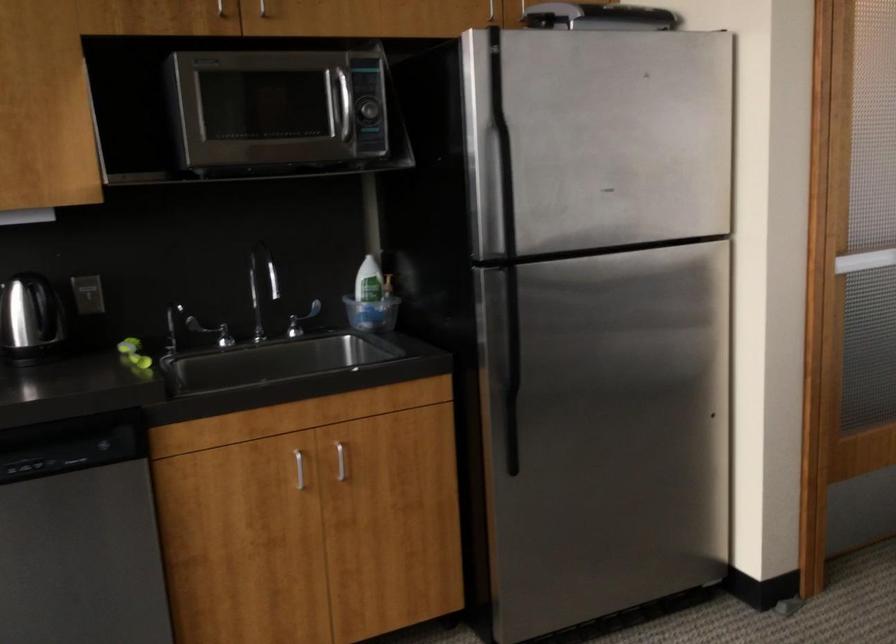
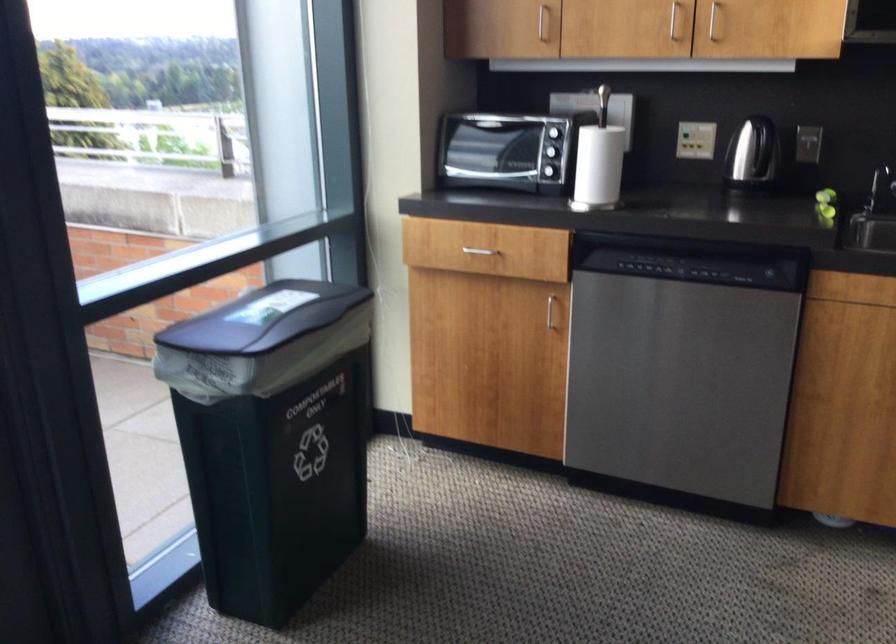
The point at (169, 337) is marked in the first image. Where is the corresponding point in the second image?

(879, 187)